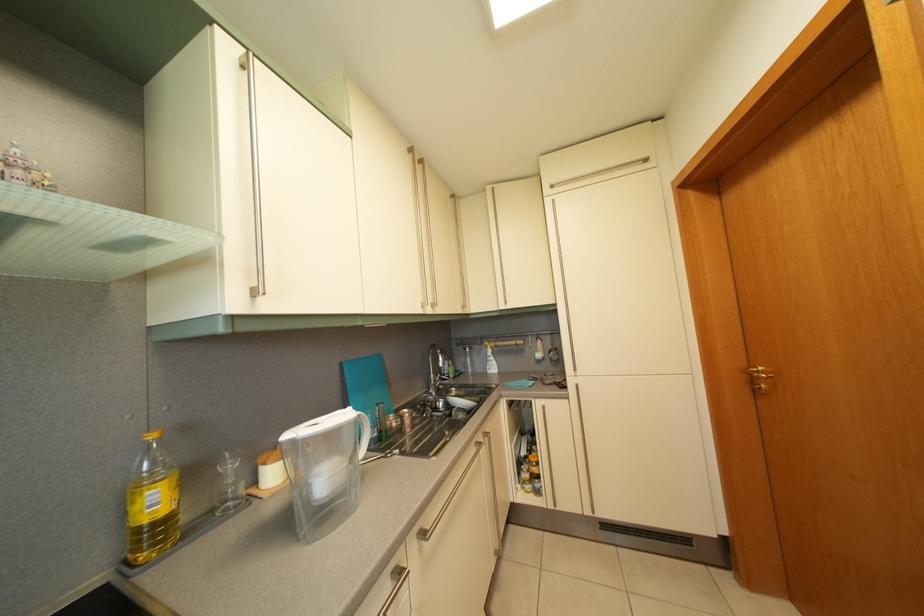
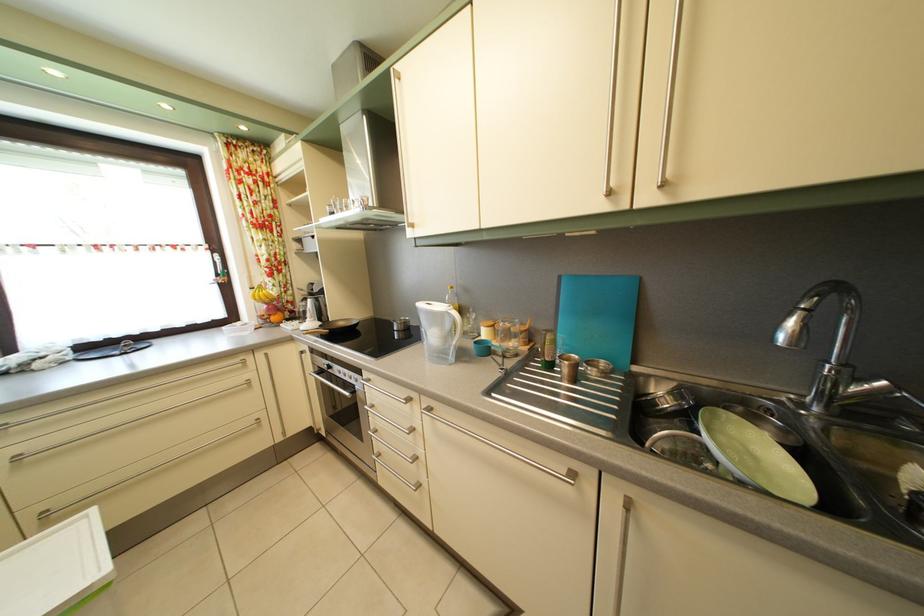
Where in the second image is the point corresponding to (x=416, y=429) from the first image?

(574, 378)